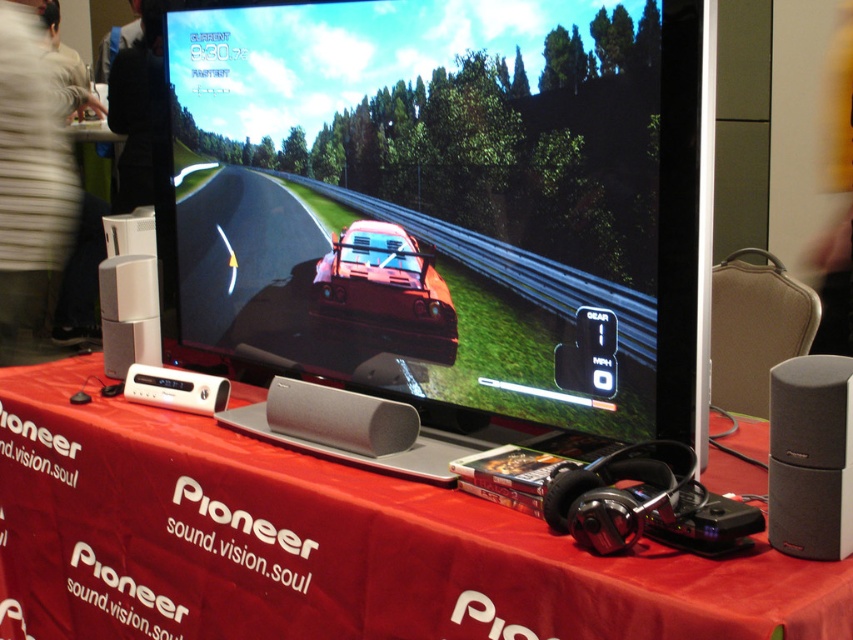
Question: Can you confirm if silver/matte speaker at center is positioned above white plastic speaker at center?

Choices:
 (A) yes
 (B) no

Answer: (B)

Question: Where is shiny black monitor at center located in relation to black matte speaker at right in the image?

Choices:
 (A) below
 (B) above

Answer: (B)

Question: Which point is closer to the camera taking this photo?

Choices:
 (A) (775, 401)
 (B) (473, 560)
 (C) (157, 333)

Answer: (A)

Question: Where is red fabric table at center located in relation to white plastic speaker at lower left in the image?

Choices:
 (A) right
 (B) left

Answer: (A)

Question: Among these points, which one is farthest from the camera?

Choices:
 (A) (22, 92)
 (B) (457, 422)
 (C) (816, 484)

Answer: (A)

Question: Which object is farther from the camera taking this photo?

Choices:
 (A) black matte speaker at right
 (B) red fabric table at center
 (C) white plastic speaker at lower left

Answer: (C)